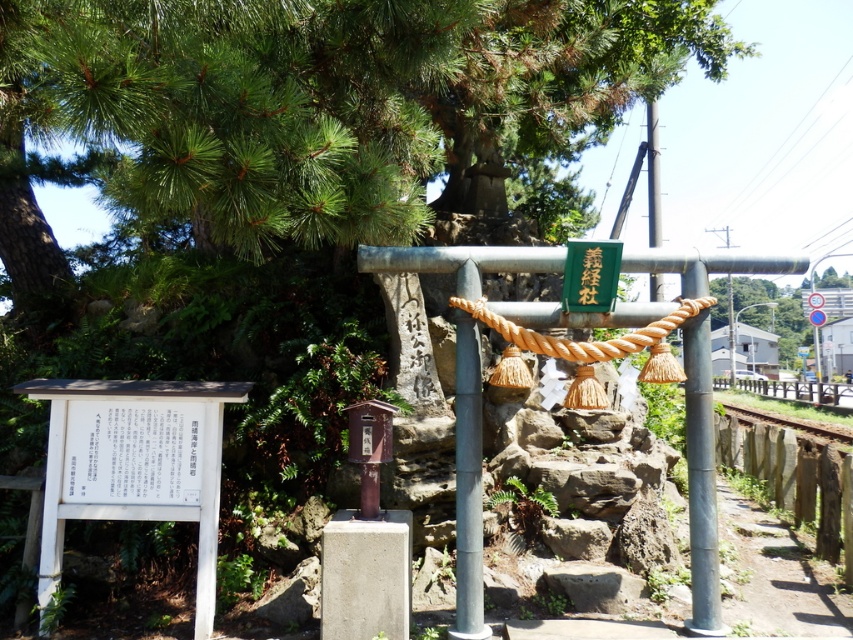
You are standing at the center of the image and want to locate the metallic gray pole at right. Based on the coordinates provided, in which direction should you look to find it?

The metallic gray pole at right is located at coordinates point (701, 481), so you should look to the right and slightly upward from the center of the image to find it.

You are standing in front of the torii gate and want to take a photo. There are two points marked in the image, point 1 at coordinates point (80, 474) and point 2 at coordinates point (480, 518). Which point is closer to your camera?

Point (80, 474) is further to the camera than point (480, 518), so point (480, 518) is closer to your camera.